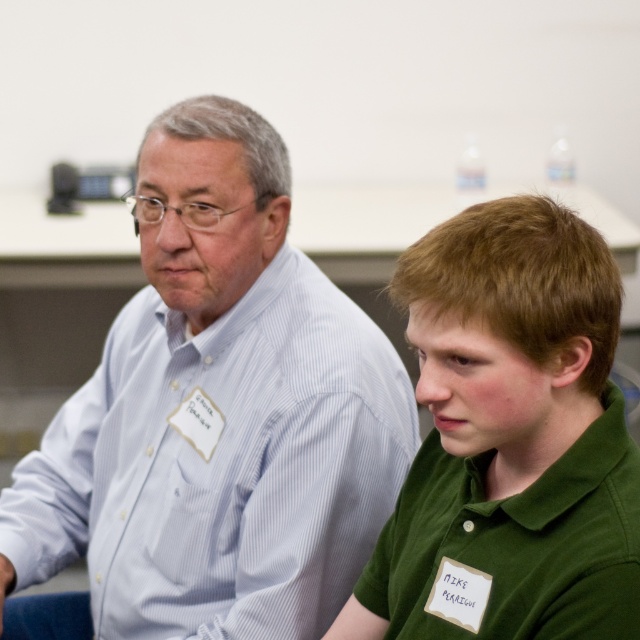
Question: Among these points, which one is nearest to the camera?

Choices:
 (A) (259, 554)
 (B) (500, 378)

Answer: (B)

Question: Which point is farther to the camera?

Choices:
 (A) light blue striped shirt at left
 (B) green matte shirt at right

Answer: (A)

Question: Is light blue striped shirt at left positioned behind green matte shirt at right?

Choices:
 (A) no
 (B) yes

Answer: (B)

Question: Can you confirm if light blue striped shirt at left is positioned to the left of green matte shirt at right?

Choices:
 (A) no
 (B) yes

Answer: (B)

Question: Is light blue striped shirt at left positioned at the back of green matte shirt at right?

Choices:
 (A) yes
 (B) no

Answer: (A)